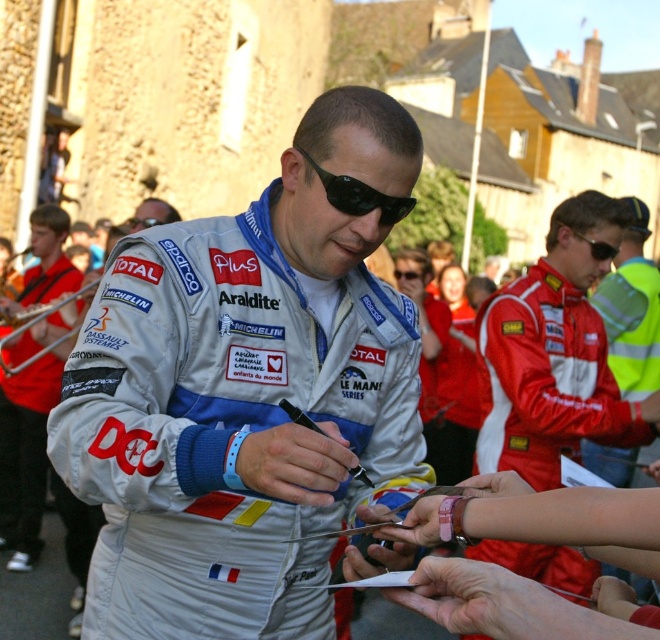
Does silver metallic racing suit at center come behind black matte sunglasses at center?

No, it is in front of black matte sunglasses at center.

Is silver metallic racing suit at center to the right of black matte sunglasses at center from the viewer's perspective?

No, silver metallic racing suit at center is not to the right of black matte sunglasses at center.

Where is `silver metallic racing suit at center`? silver metallic racing suit at center is located at coordinates (232, 412).

Image resolution: width=660 pixels, height=640 pixels. Find the location of `silver metallic racing suit at center`. silver metallic racing suit at center is located at coordinates (232, 412).

Between smooth leather hand at center and black plastic goggles at center, which one appears on the left side from the viewer's perspective?

smooth leather hand at center

Who is higher up, smooth leather hand at center or black plastic goggles at center?

black plastic goggles at center

The image size is (660, 640). What are the coordinates of `smooth leather hand at center` in the screenshot? It's located at (294, 464).

Where is `smooth leather hand at center`? smooth leather hand at center is located at coordinates (294, 464).

Does red reflective jacket at right have a smaller size compared to black plastic sunglasses at center?

Incorrect, red reflective jacket at right is not smaller in size than black plastic sunglasses at center.

Which is above, red reflective jacket at right or black plastic sunglasses at center?

black plastic sunglasses at center

Is point (620, 456) less distant than point (605, 248)?

No, (620, 456) is further to viewer.

Locate an element on the screen. The image size is (660, 640). red reflective jacket at right is located at coordinates (632, 308).